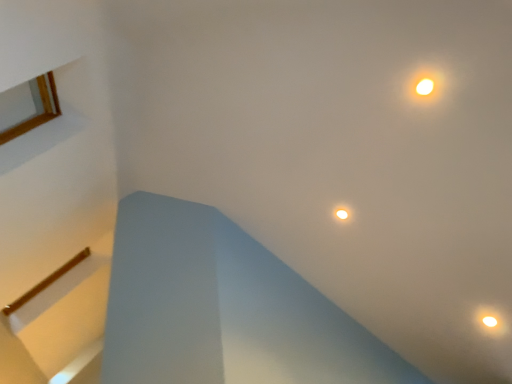
Question: Does matte yellow light at upper right turn towards matte white droplight at lower right, the second droplight positioned from the back?

Choices:
 (A) yes
 (B) no

Answer: (B)

Question: Can you confirm if matte yellow light at upper right is wider than matte white droplight at lower right, placed as the 1th droplight when sorted from front to back?

Choices:
 (A) no
 (B) yes

Answer: (A)

Question: Is matte yellow light at upper right bigger than matte white droplight at lower right, which ranks as the 1th droplight in right-to-left order?

Choices:
 (A) no
 (B) yes

Answer: (B)

Question: From the image's perspective, is matte yellow light at upper right located above matte white droplight at lower right, the second droplight positioned from the back?

Choices:
 (A) no
 (B) yes

Answer: (B)

Question: Is matte yellow light at upper right beside matte white droplight at lower right, the second droplight positioned from the top?

Choices:
 (A) no
 (B) yes

Answer: (A)

Question: Considering their positions, is matte white droplight at lower right, the second droplight positioned from the top, located in front of or behind matte yellow light at upper right?

Choices:
 (A) front
 (B) behind

Answer: (B)

Question: Is matte white droplight at lower right, positioned as the second droplight in left-to-right order, inside or outside of matte yellow light at upper right?

Choices:
 (A) inside
 (B) outside

Answer: (B)

Question: From the image's perspective, relative to matte yellow light at upper right, is matte white droplight at lower right, positioned as the second droplight in left-to-right order, above or below?

Choices:
 (A) above
 (B) below

Answer: (B)

Question: Is matte white droplight at lower right, the second droplight positioned from the top, to the left or to the right of matte yellow light at upper right in the image?

Choices:
 (A) left
 (B) right

Answer: (B)

Question: From the image's perspective, is matte yellow light at upper right located above or below matte gold droplight at center, which is counted as the second droplight, starting from the front?

Choices:
 (A) above
 (B) below

Answer: (A)

Question: Considering the positions of point (423, 92) and point (343, 216), is point (423, 92) closer or farther from the camera than point (343, 216)?

Choices:
 (A) closer
 (B) farther

Answer: (A)

Question: Looking at their shapes, would you say matte yellow light at upper right is wider or thinner than matte gold droplight at center, which ranks as the 1th droplight in left-to-right order?

Choices:
 (A) thin
 (B) wide

Answer: (A)

Question: Considering the positions of matte yellow light at upper right and matte gold droplight at center, which is the 1th droplight from top to bottom, in the image, is matte yellow light at upper right bigger or smaller than matte gold droplight at center, which is the 1th droplight from top to bottom,?

Choices:
 (A) big
 (B) small

Answer: (B)

Question: From the image's perspective, is matte gold droplight at center, which is the 1th droplight from top to bottom, above or below matte white droplight at lower right, which is the first droplight from bottom to top?

Choices:
 (A) below
 (B) above

Answer: (B)

Question: Is matte gold droplight at center, which is counted as the 1th droplight, starting from the back, in front of or behind matte white droplight at lower right, positioned as the second droplight in left-to-right order, in the image?

Choices:
 (A) behind
 (B) front

Answer: (A)